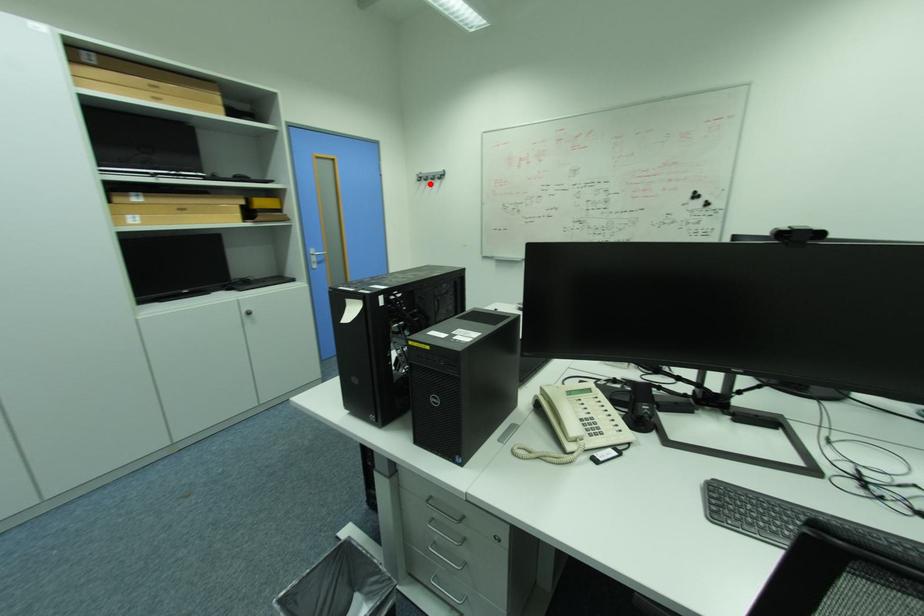
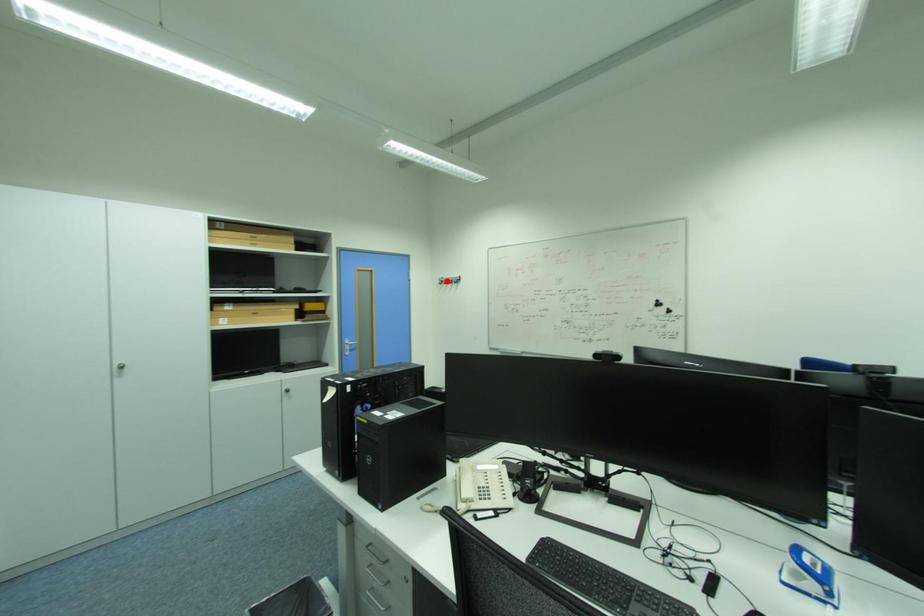
I am providing you with two images of the same scene from different viewpoints. A red point is marked on the first image and another point is marked on the second image. Is the red point in image1 aligned with the point shown in image2?

No